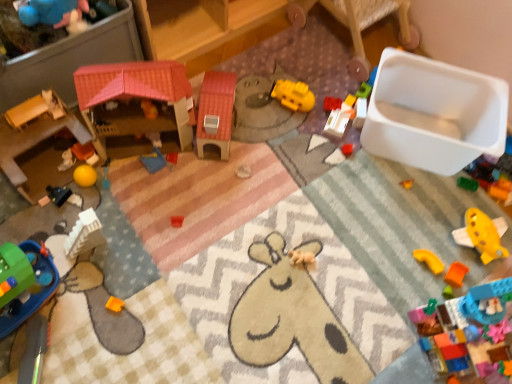
Identify the location of free area in between yellow matte plastic toy at center, which is the 8th toy from right to left, and orange matte block at lower right, which ranks as the second toy in right-to-left order. The height and width of the screenshot is (384, 512). (364, 184).